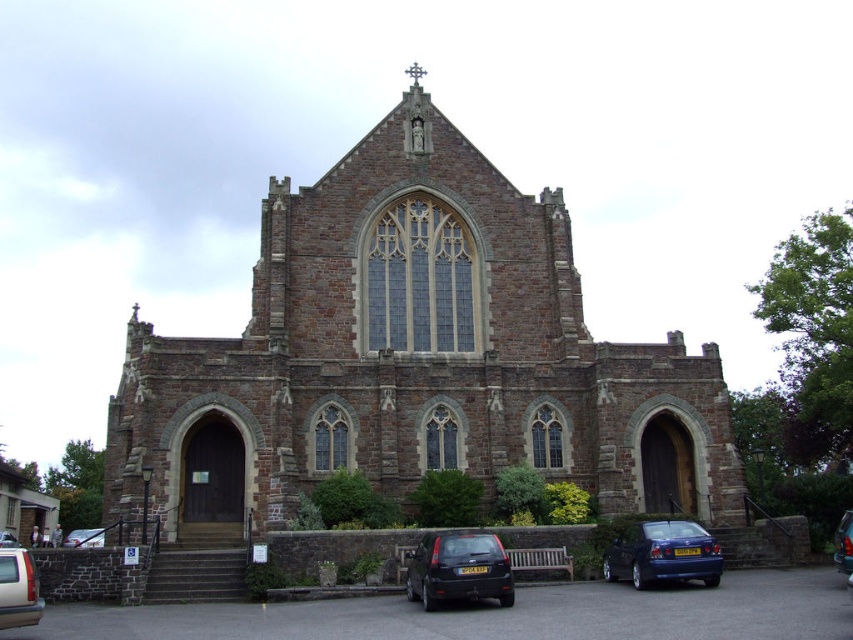
Question: Where is brown stone church at center located in relation to matte silver car at lower left in the image?

Choices:
 (A) left
 (B) right

Answer: (B)

Question: Based on their relative distances, which object is nearer to the metallic silver car at lower left?

Choices:
 (A) brown stone church at center
 (B) matte black car at center

Answer: (A)

Question: Estimate the real-world distances between objects in this image. Which object is farther from the metallic blue sedan at center?

Choices:
 (A) gold metallic van at lower left
 (B) matte black car at center

Answer: (A)

Question: Which object is closer to the camera taking this photo?

Choices:
 (A) matte silver car at lower left
 (B) metallic blue sedan at center

Answer: (B)

Question: Is matte silver car at lower left thinner than metallic silver car at lower left?

Choices:
 (A) yes
 (B) no

Answer: (B)

Question: Is brown stone church at center closer to the viewer compared to shiny blue sedan at lower right?

Choices:
 (A) yes
 (B) no

Answer: (B)